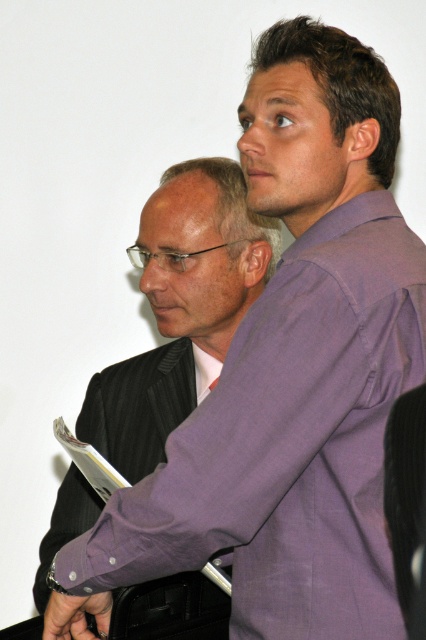
Where is `purple matte shirt at center`? This screenshot has height=640, width=426. purple matte shirt at center is located at coordinates (181, 308).

Does point (43, 608) come behind point (129, 632)?

That is True.

Who is more forward, [123,611] or [149,448]?

Point [123,611]

The width and height of the screenshot is (426, 640). What are the coordinates of `purple matte shirt at center` in the screenshot? It's located at (181, 308).